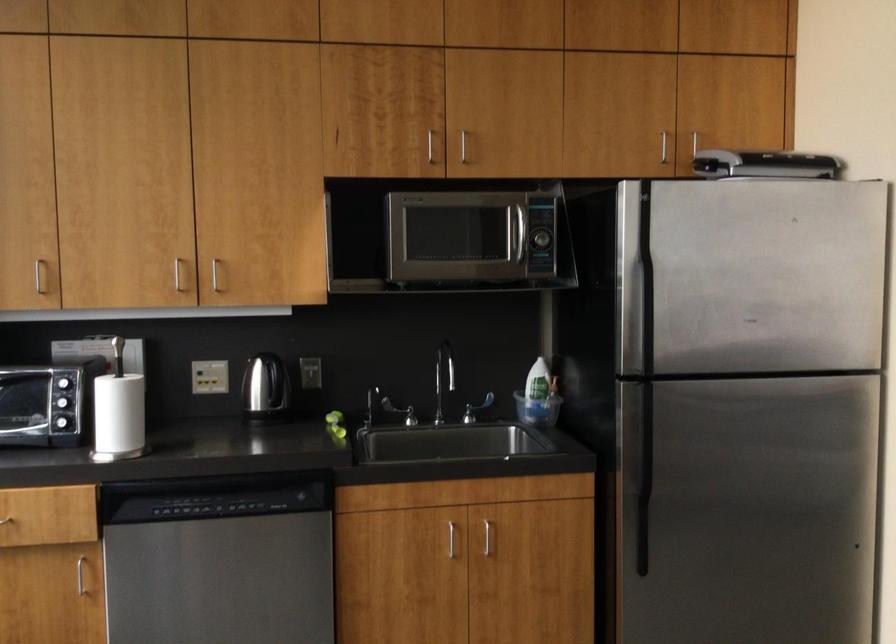
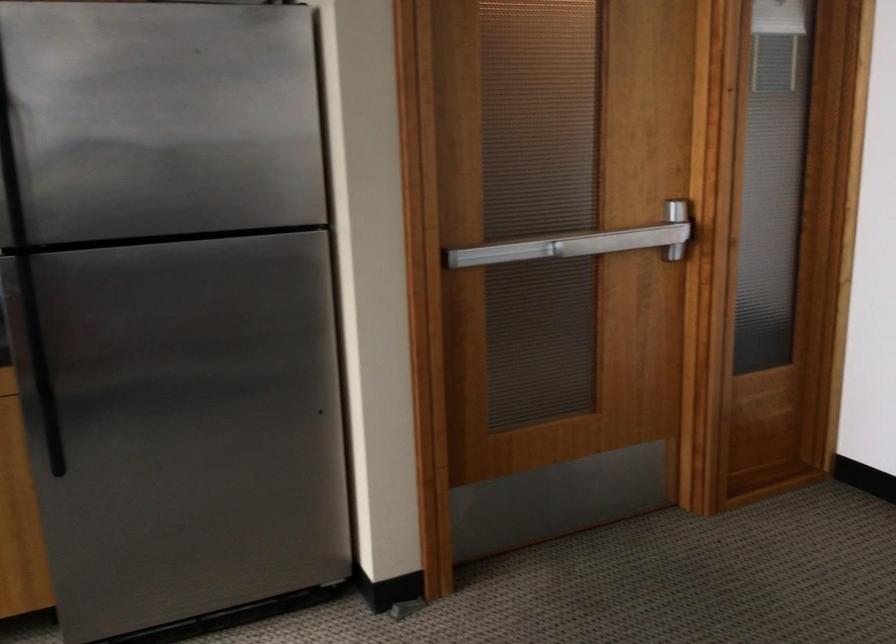
Find the pixel in the second image that matches point 616,328 in the first image.

(10, 198)